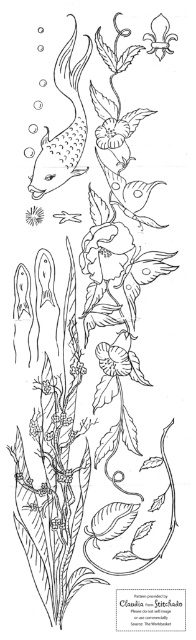
Between point (159, 17) and point (33, 209), which one is positioned behind?

The point (33, 209) is behind.

Locate an element on the screen. This screenshot has width=196, height=640. white paper flower at upper center is located at coordinates (158, 36).

Does point (153, 52) lie behind point (28, 211)?

No, (153, 52) is in front of (28, 211).

Locate an element on the screen. The width and height of the screenshot is (196, 640). white paper flower at upper center is located at coordinates (158, 36).

Does matte black fish at upper left have a lesser height compared to matte black flower at upper left?

In fact, matte black fish at upper left may be taller than matte black flower at upper left.

Is point (69, 44) farther from viewer compared to point (39, 205)?

No.

Is point (42, 161) positioned before point (39, 209)?

Yes, point (42, 161) is in front of point (39, 209).

Image resolution: width=196 pixels, height=640 pixels. Find the location of `matte black fish at upper left`. matte black fish at upper left is located at coordinates (65, 128).

Can you confirm if matte black fish at upper left is bigger than white paper flower at upper center?

Indeed, matte black fish at upper left has a larger size compared to white paper flower at upper center.

Between point (54, 161) and point (160, 28), which one is positioned in front?

Point (160, 28)

Find the location of a particular element. This screenshot has width=196, height=640. matte black fish at upper left is located at coordinates coord(65,128).